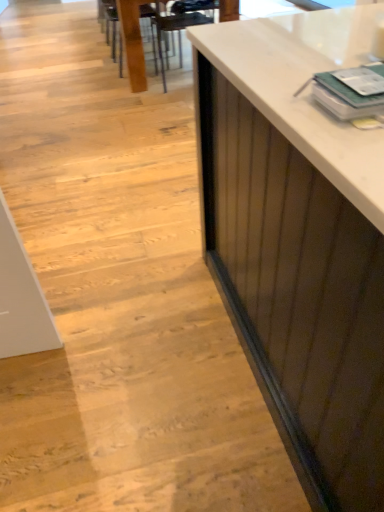
What is the approximate height of wooden table at center?

27.19 inches.

This screenshot has width=384, height=512. Describe the element at coordinates (133, 41) in the screenshot. I see `wooden table at center` at that location.

Find the location of a particular element. This screenshot has height=512, width=384. metallic dark brown armchair at upper center is located at coordinates (179, 25).

Does wooden chair at upper center turn towards metallic dark brown armchair at upper center?

No.

Which object is wider, wooden chair at upper center or metallic dark brown armchair at upper center?

Wider between the two is metallic dark brown armchair at upper center.

Considering the relative positions of wooden chair at upper center and metallic dark brown armchair at upper center in the image provided, is wooden chair at upper center to the left or to the right of metallic dark brown armchair at upper center?

wooden chair at upper center is positioned on metallic dark brown armchair at upper center's left side.

Is metallic dark brown armchair at upper center taller than wooden chair at upper center?

Correct, metallic dark brown armchair at upper center is much taller as wooden chair at upper center.

Is metallic dark brown armchair at upper center oriented away from wooden chair at upper center?

metallic dark brown armchair at upper center is not turned away from wooden chair at upper center.

Is metallic dark brown armchair at upper center next to wooden chair at upper center and touching it?

No, metallic dark brown armchair at upper center is not making contact with wooden chair at upper center.

From a real-world perspective, does metallic dark brown armchair at upper center sit lower than wooden chair at upper center?

No, from a real-world perspective, metallic dark brown armchair at upper center is not beneath wooden chair at upper center.

Which is further, (147, 0) or (140, 70)?

The point (147, 0) is more distant.

Would you say wooden chair at upper center contains wooden table at center?

No, wooden table at center is not a part of wooden chair at upper center.

From the image's perspective, does wooden chair at upper center appear lower than wooden table at center?

Yes, from the image's perspective, wooden chair at upper center is beneath wooden table at center.

From their relative heights in the image, would you say wooden chair at upper center is taller or shorter than wooden table at center?

In the image, wooden chair at upper center appears to be shorter than wooden table at center.

Who is shorter, wooden table at center or metallic dark brown armchair at upper center?

metallic dark brown armchair at upper center is shorter.

Between wooden table at center and metallic dark brown armchair at upper center, which one has smaller width?

metallic dark brown armchair at upper center.

Is wooden table at center closer to camera compared to metallic dark brown armchair at upper center?

No, it is not.

Is wooden table at center bigger or smaller than wooden chair at upper center?

In the image, wooden table at center appears to be larger than wooden chair at upper center.

Identify the location of table that appears above the wooden chair at upper center (from the image's perspective). The width and height of the screenshot is (384, 512). (133, 41).

Can you confirm if wooden table at center is shorter than wooden chair at upper center?

No.

From the picture: Would you consider metallic dark brown armchair at upper center to be distant from wooden table at center?

No, metallic dark brown armchair at upper center is in close proximity to wooden table at center.

Who is more distant, metallic dark brown armchair at upper center or wooden table at center?

Positioned behind is wooden table at center.

From the image's perspective, is metallic dark brown armchair at upper center located beneath wooden table at center?

Correct, metallic dark brown armchair at upper center appears lower than wooden table at center in the image.

Between point (166, 54) and point (139, 48), which one is positioned in front?

The point (139, 48) is more forward.

The width and height of the screenshot is (384, 512). Find the location of `armchair below the wooden chair at upper center (from the image's perspective)`. armchair below the wooden chair at upper center (from the image's perspective) is located at coordinates (179, 25).

Where is `armchair located on the right of wooden chair at upper center`? The image size is (384, 512). armchair located on the right of wooden chair at upper center is located at coordinates (179, 25).

Based on their spatial positions, is metallic dark brown armchair at upper center or wooden chair at upper center closer to wooden table at center?

wooden chair at upper center lies closer to wooden table at center than the other object.

Considering their positions, is wooden chair at upper center positioned closer to metallic dark brown armchair at upper center than wooden table at center?

Based on the image, wooden table at center appears to be nearer to metallic dark brown armchair at upper center.

Based on their spatial positions, is metallic dark brown armchair at upper center or wooden table at center closer to wooden chair at upper center?

wooden table at center is closer to wooden chair at upper center.

From the image, which object appears to be farther from wooden chair at upper center, wooden table at center or metallic dark brown armchair at upper center?

Among the two, metallic dark brown armchair at upper center is located further to wooden chair at upper center.

Considering their positions, is wooden table at center positioned closer to metallic dark brown armchair at upper center than wooden chair at upper center?

wooden table at center is closer to metallic dark brown armchair at upper center.

Consider the image. Looking at the image, which one is located closer to wooden table at center, wooden chair at upper center or metallic dark brown armchair at upper center?

Based on the image, wooden chair at upper center appears to be nearer to wooden table at center.

Locate an element on the screen. chair that lies between wooden table at center and metallic dark brown armchair at upper center from top to bottom is located at coordinates (133, 41).